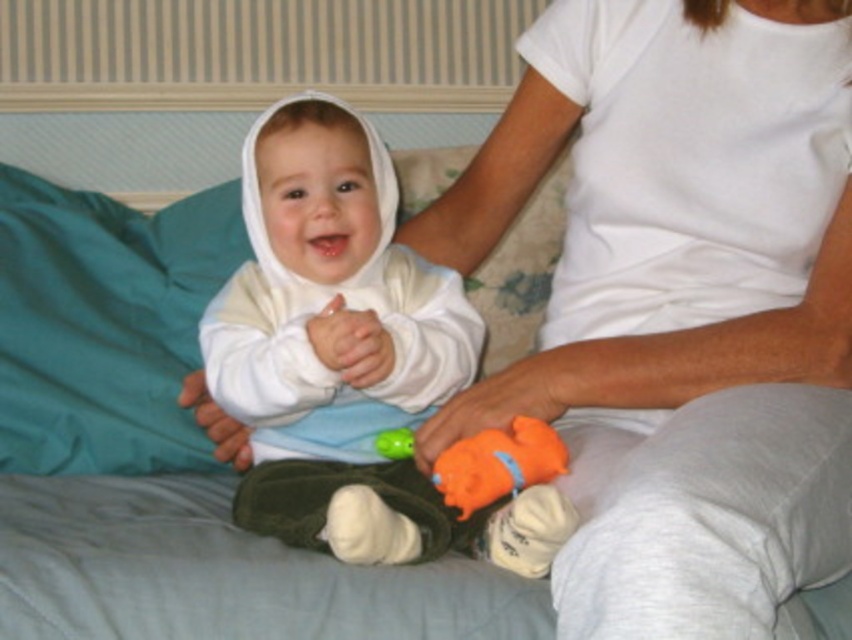
Question: Where is orange rubber duck at lower center located in relation to green fabric toy at center in the image?

Choices:
 (A) below
 (B) above

Answer: (A)

Question: Which of these objects is positioned closest to the green fabric toy at center?

Choices:
 (A) orange rubber duck at lower center
 (B) white soft baby at center

Answer: (A)

Question: Does orange rubber duck at lower center appear on the left side of green fabric toy at center?

Choices:
 (A) no
 (B) yes

Answer: (A)

Question: Considering the real-world distances, which object is farthest from the orange rubber duck at lower center?

Choices:
 (A) white soft baby at center
 (B) green fabric toy at center

Answer: (A)

Question: Can you confirm if white soft baby at center is bigger than orange rubber duck at lower center?

Choices:
 (A) no
 (B) yes

Answer: (B)

Question: Estimate the real-world distances between objects in this image. Which object is closer to the orange rubber duck at lower center?

Choices:
 (A) white soft baby at center
 (B) green fabric toy at center

Answer: (B)